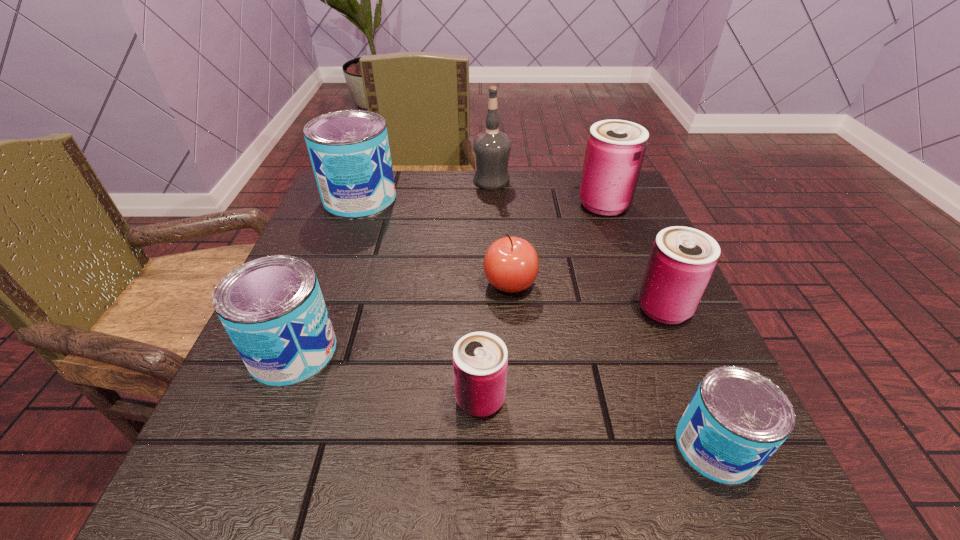
In the image, there is a desktop. Where is `free space at the far right corner`? The height and width of the screenshot is (540, 960). free space at the far right corner is located at coordinates (x=566, y=189).

The width and height of the screenshot is (960, 540). In the image, there is a desktop. Find the location of `vacant space at the near right corner`. vacant space at the near right corner is located at coordinates (759, 507).

I want to click on empty space that is in between the second smallest pink can and the apple, so click(x=587, y=295).

Where is `vacant space in between the tallest object and the apple`? vacant space in between the tallest object and the apple is located at coordinates (501, 232).

Locate an element on the screen. Image resolution: width=960 pixels, height=540 pixels. vacant area that lies between the second farthest pink can and the apple is located at coordinates (587, 295).

This screenshot has height=540, width=960. I want to click on vacant space that is in between the leftmost pink can and the second biggest blue can, so click(387, 375).

Where is `free area in between the second farthest pink can and the fourth can from right to left`? The height and width of the screenshot is (540, 960). free area in between the second farthest pink can and the fourth can from right to left is located at coordinates (572, 353).

This screenshot has height=540, width=960. In order to click on vacant area that lies between the farthest blue can and the apple in this screenshot , I will do `click(435, 241)`.

Find the location of `empty space between the biggest pink can and the nearest blue can`. empty space between the biggest pink can and the nearest blue can is located at coordinates (660, 326).

Locate an element on the screen. The height and width of the screenshot is (540, 960). free space between the fourth can from right to left and the tallest object is located at coordinates (486, 290).